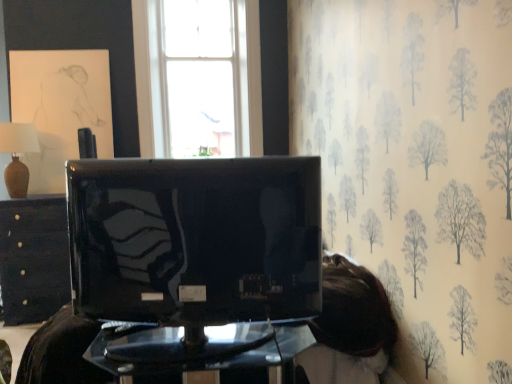
Question: Is matte black television at center taller or shorter than matte beige vase at left?

Choices:
 (A) tall
 (B) short

Answer: (A)

Question: Would you say matte black television at center is to the left or to the right of matte beige vase at left in the picture?

Choices:
 (A) right
 (B) left

Answer: (A)

Question: Which object is the closest to the matte beige vase at left?

Choices:
 (A) matte black television at center
 (B) black glossy drawer at left, placed as the 1th furniture when sorted from back to front
 (C) transparent glass table at center, which is the 1th furniture in front-to-back order

Answer: (B)

Question: Based on their relative distances, which object is farther from the black glossy drawer at left, placed as the 1th furniture when sorted from back to front?

Choices:
 (A) transparent glass table at center, the first furniture from the right
 (B) matte beige vase at left
 (C) matte black television at center

Answer: (C)